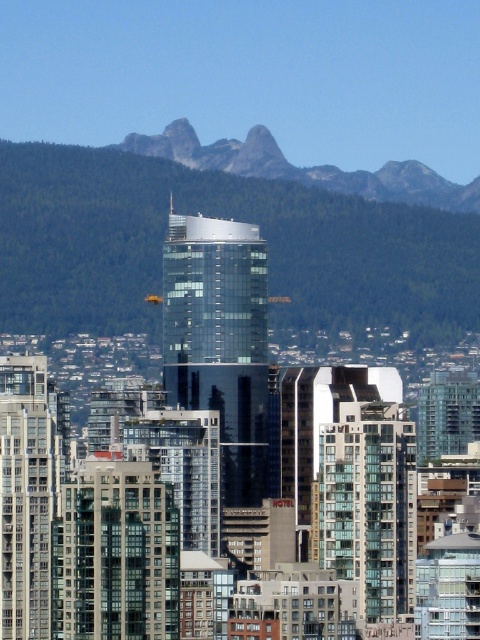
Which is above, green forested mountain at upper center or gray rocky mountain at upper center?

Positioned higher is gray rocky mountain at upper center.

Looking at this image, does green forested mountain at upper center have a lesser height compared to gray rocky mountain at upper center?

Incorrect, green forested mountain at upper center's height does not fall short of gray rocky mountain at upper center's.

The width and height of the screenshot is (480, 640). Identify the location of green forested mountain at upper center. (219, 216).

Identify the location of green forested mountain at upper center. This screenshot has width=480, height=640. (219, 216).